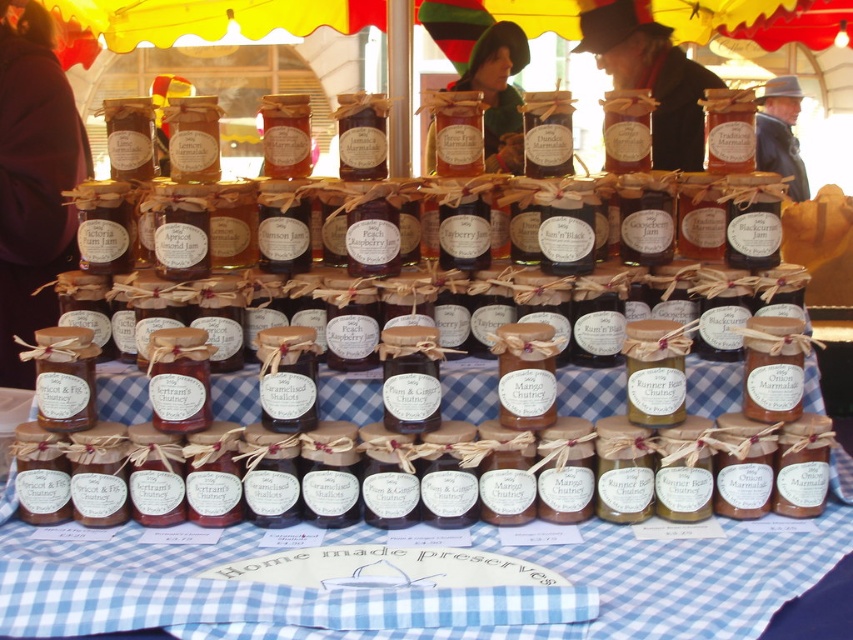
You are at the market stall and want to take a photo of the preserves. You notice two points marked in the scene. Which point is closer to your camera lens? Please choose between the point at coordinates (41, 298) and the point at (503, 164).

The point at coordinates (41, 298) is closer to the camera lens than the point at (503, 164).

Based on the photo, you are at the market stall and want to place a jar on the blue checkered fabric at center. However, there is a dark brown wool coat at left nearby. Which object is shorter so that the jar can be placed without obstruction?

The blue checkered fabric at center is shorter than the dark brown wool coat at left, so placing the jar on the blue checkered fabric at center would be possible without obstruction.